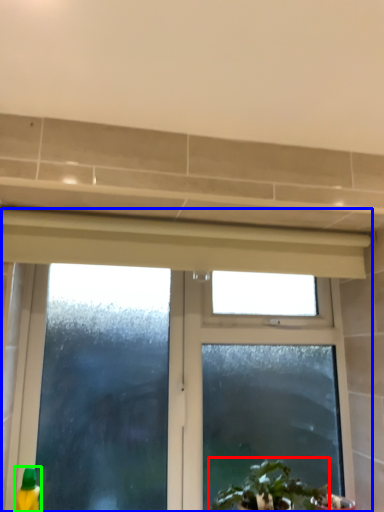
Question: Based on their relative distances, which object is farther from houseplant (highlighted by a red box)? Choose from window (highlighted by a blue box) and cleaning product (highlighted by a green box).

Choices:
 (A) window
 (B) cleaning product

Answer: (B)